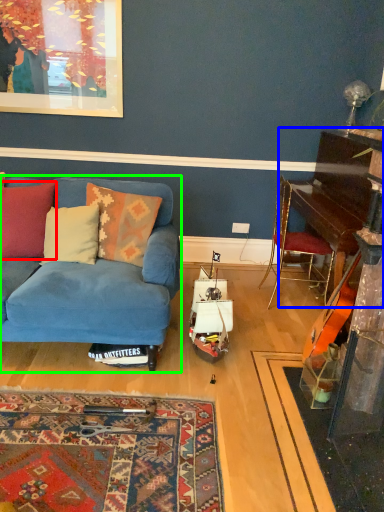
Question: Which object is positioned closest to pillow (highlighted by a red box)? Select from piano (highlighted by a blue box) and studio couch (highlighted by a green box).

Choices:
 (A) piano
 (B) studio couch

Answer: (B)